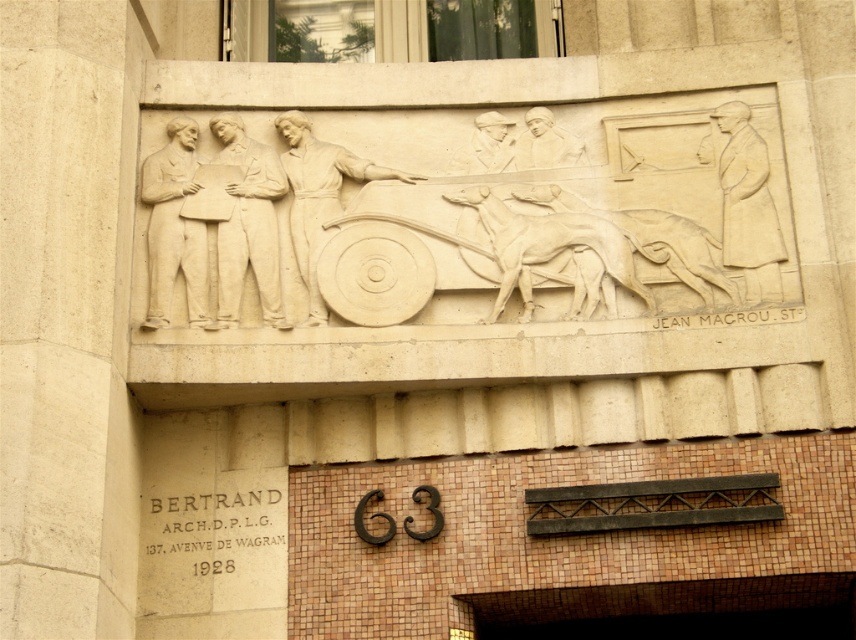
You are an art student analyzing the relief sculpture. You notice two elements in the scene. One is the beige stone figure at upper left and the other is the white stone shield at center. Which of these two elements is positioned to the left of the other?

The beige stone figure at upper left is positioned to the left of the white stone shield at center.

You are an architect analyzing the relief sculpture on the building facade. You notice a point marked at coordinates (551, 246). What does this point represent in the relief?

The point at coordinates (551, 246) represents the white stone horses at center.

You are an architect analyzing the placement of the beige stone figure at upper left in the relief sculpture. What are the coordinates of this figure relative to the sculpture?

The beige stone figure at upper left is located at point coordinates of [174,227].